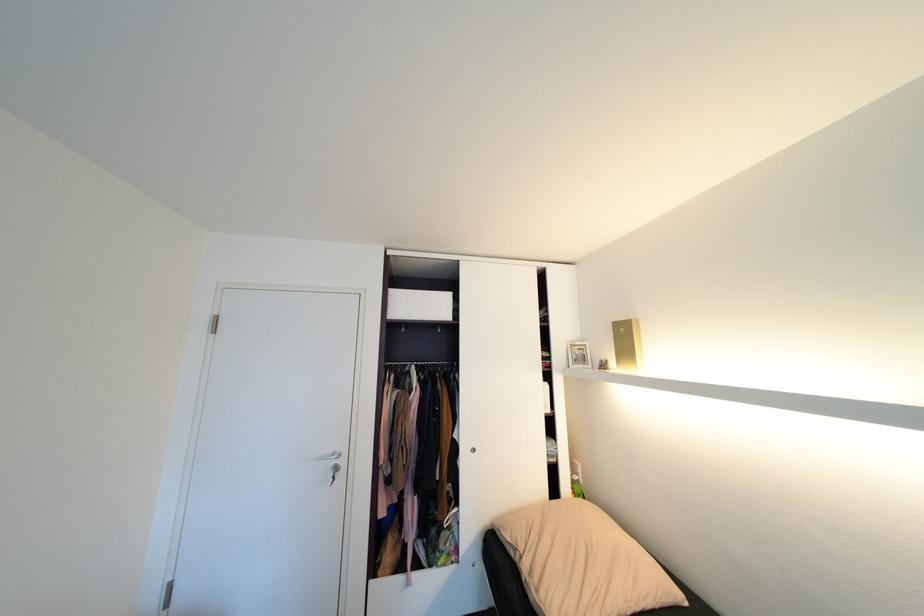
The image size is (924, 616). Find the location of `closet door pull`. closet door pull is located at coordinates (476, 453).